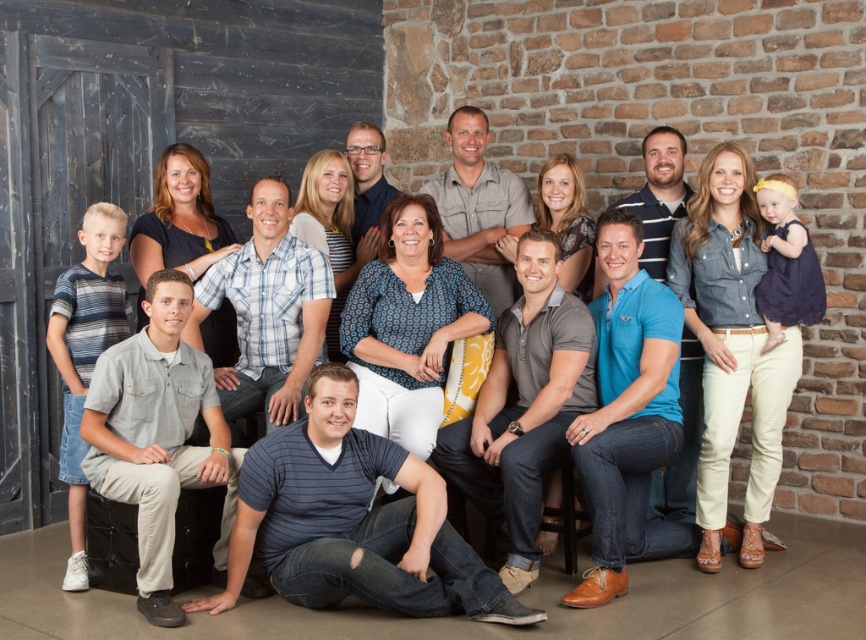
Is striped cotton shirt at center shorter than blue striped shirt at center?

Correct, striped cotton shirt at center is not as tall as blue striped shirt at center.

Is striped cotton shirt at center positioned at the back of blue striped shirt at center?

No, it is not.

Does point (410, 513) come in front of point (198, 316)?

Yes, it is.

This screenshot has height=640, width=866. Identify the location of striped cotton shirt at center. (353, 522).